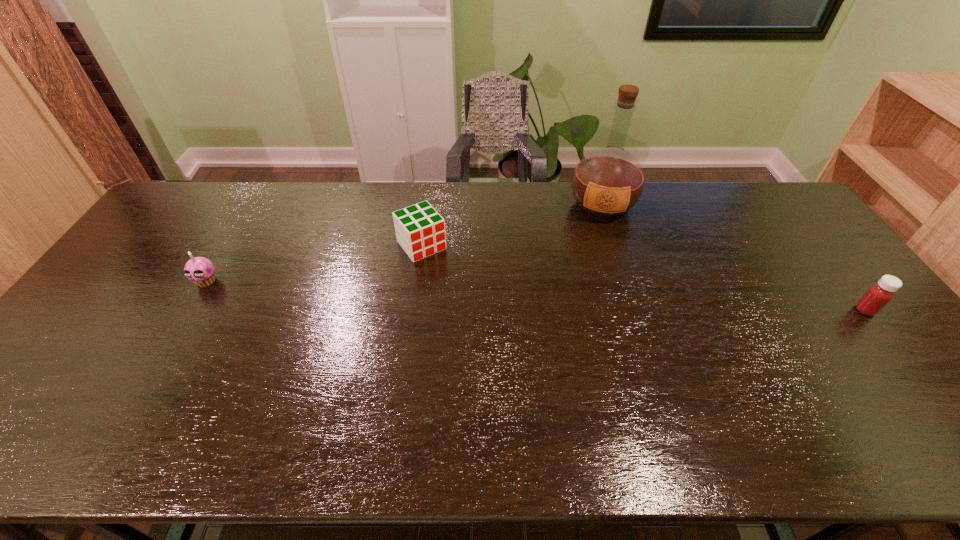
You are a GUI agent. You are given a task and a screenshot of the screen. Output one action in this format:
    pyautogui.click(x=<x>, y=<y>)
    Task: Click on the leftmost object
    This screenshot has height=540, width=960.
    Given the screenshot: What is the action you would take?
    pyautogui.click(x=200, y=270)

Where is `the third farthest object`? the third farthest object is located at coordinates (200, 270).

Identify the location of the rightmost object. (878, 295).

Locate an element on the screen. medicine is located at coordinates (878, 295).

You are a GUI agent. You are given a task and a screenshot of the screen. Output one action in this format:
    pyautogui.click(x=<x>, y=<y>)
    Task: Click on the tallest object
    The height and width of the screenshot is (540, 960).
    Given the screenshot: What is the action you would take?
    pyautogui.click(x=607, y=182)

The height and width of the screenshot is (540, 960). What are the coordinates of `the farthest object` in the screenshot? It's located at (607, 182).

Identify the location of cube. The width and height of the screenshot is (960, 540). (420, 230).

Locate an element on the screen. This screenshot has width=960, height=540. the third nearest object is located at coordinates (420, 230).

This screenshot has height=540, width=960. Identify the location of free location located 0.200m on the face of the leftmost object. (167, 348).

This screenshot has height=540, width=960. I want to click on vacant space located on the back of the rightmost object, so click(x=831, y=268).